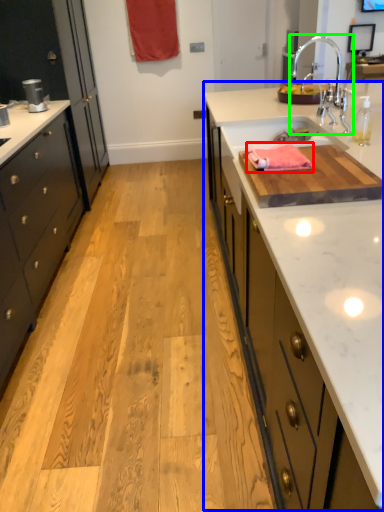
Question: Which is farther away from material (highlighted by a red box)? countertop (highlighted by a blue box) or tap (highlighted by a green box)?

Choices:
 (A) countertop
 (B) tap

Answer: (B)